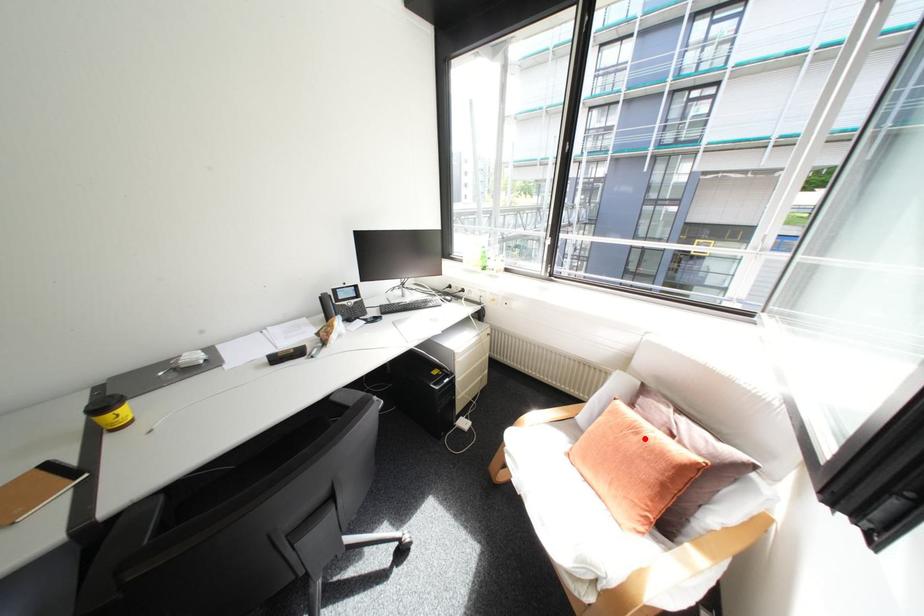
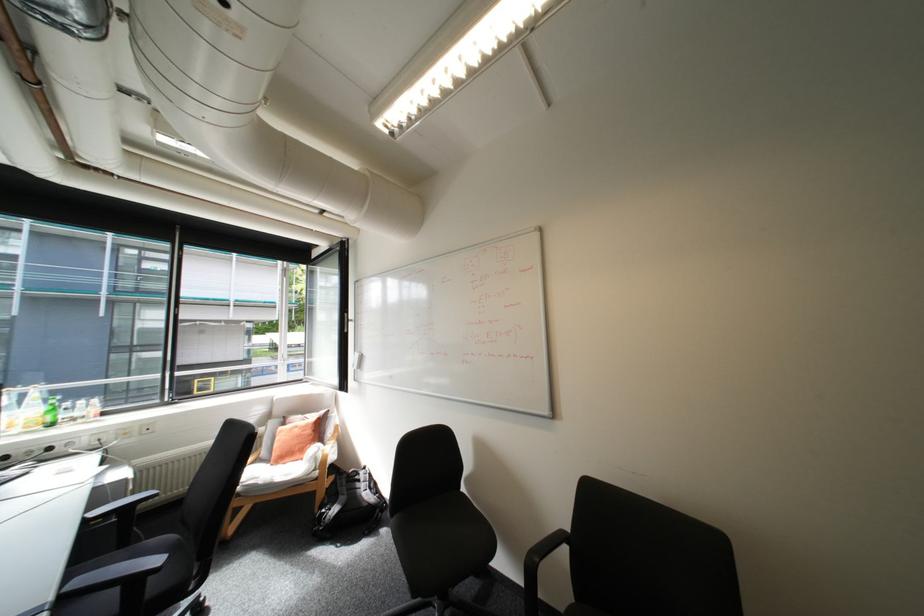
Question: I am providing you with two images of the same scene from different viewpoints. In image1, a red point is highlighted. Considering the same 3D point in image2, which of the following is correct?

Choices:
 (A) It is closer
 (B) It is farther

Answer: (B)